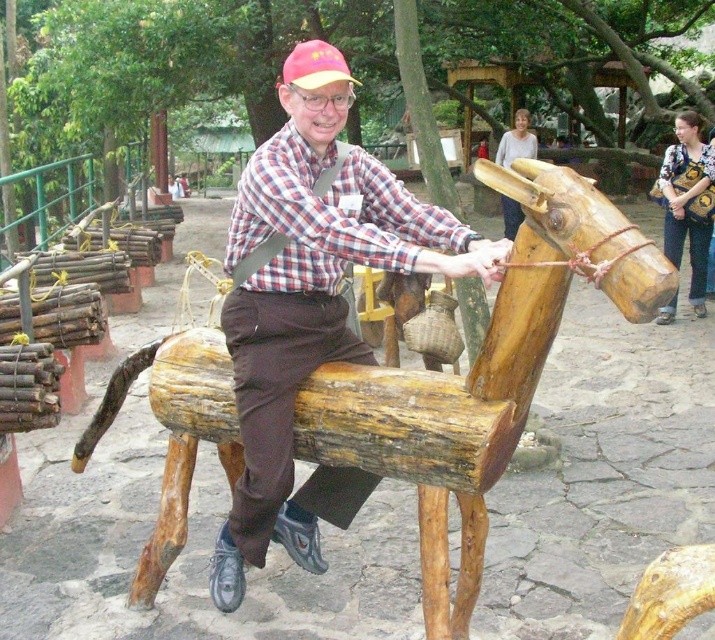
Does natural wood horse at center have a smaller size compared to wooden horse at center?

Correct, natural wood horse at center occupies less space than wooden horse at center.

Who is positioned more to the right, natural wood horse at center or wooden horse at center?

natural wood horse at center

Where is `natural wood horse at center`? The width and height of the screenshot is (715, 640). natural wood horse at center is located at coordinates (480, 376).